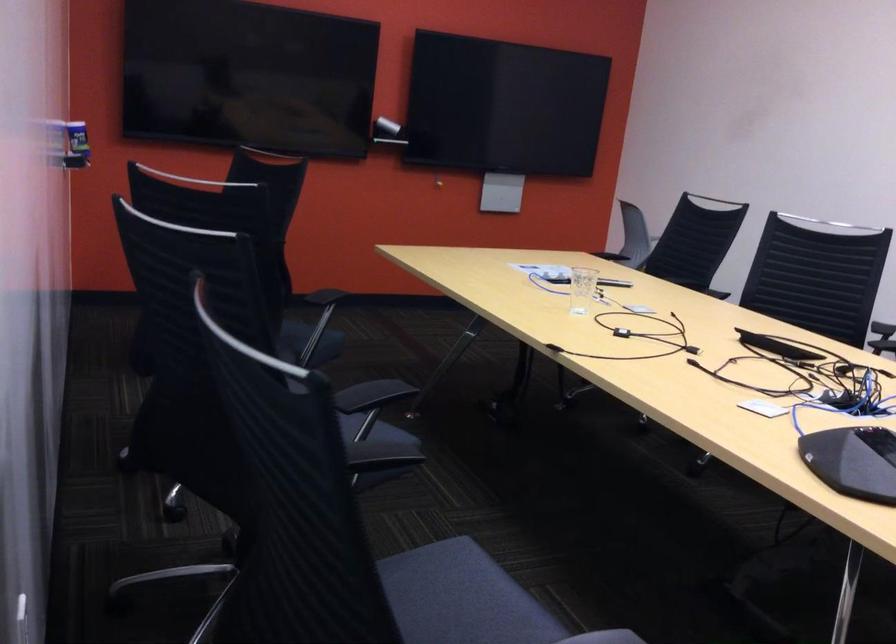
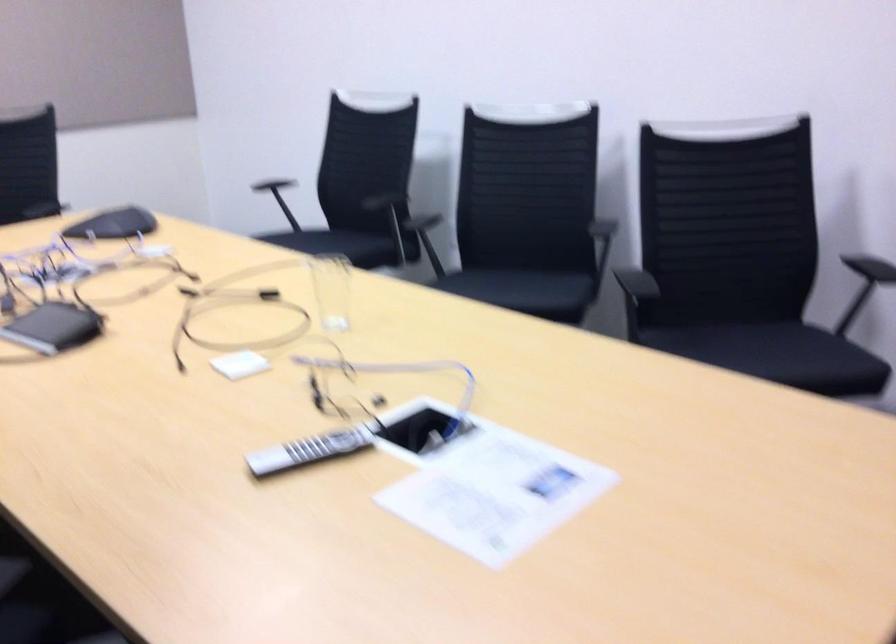
Question: I am providing you with two images of the same scene from different viewpoints. Which of the following objects are not visible in image2?

Choices:
 (A) grey remote control
 (B) black electronic device
 (C) black chair armrest
 (D) wheeled filing cabinet

Answer: (C)